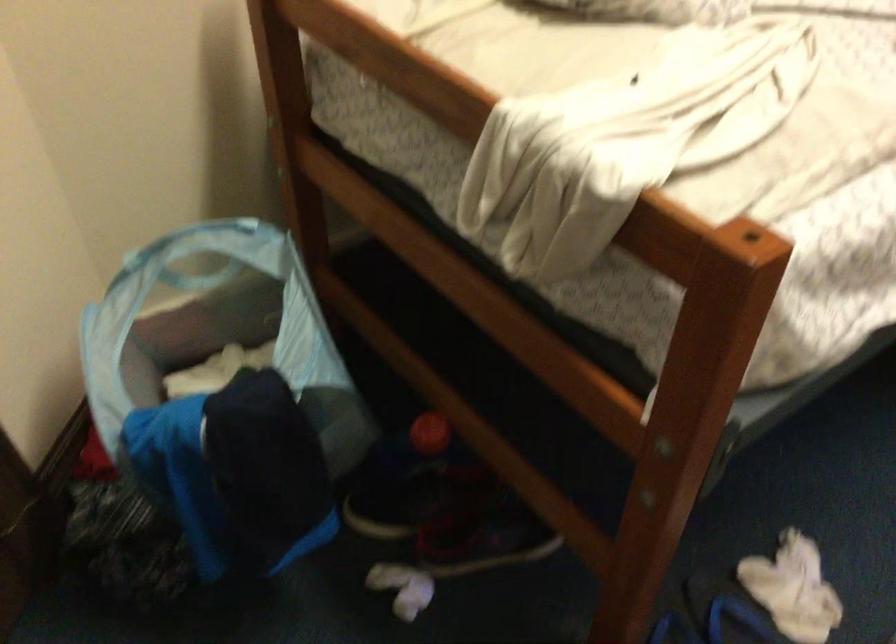
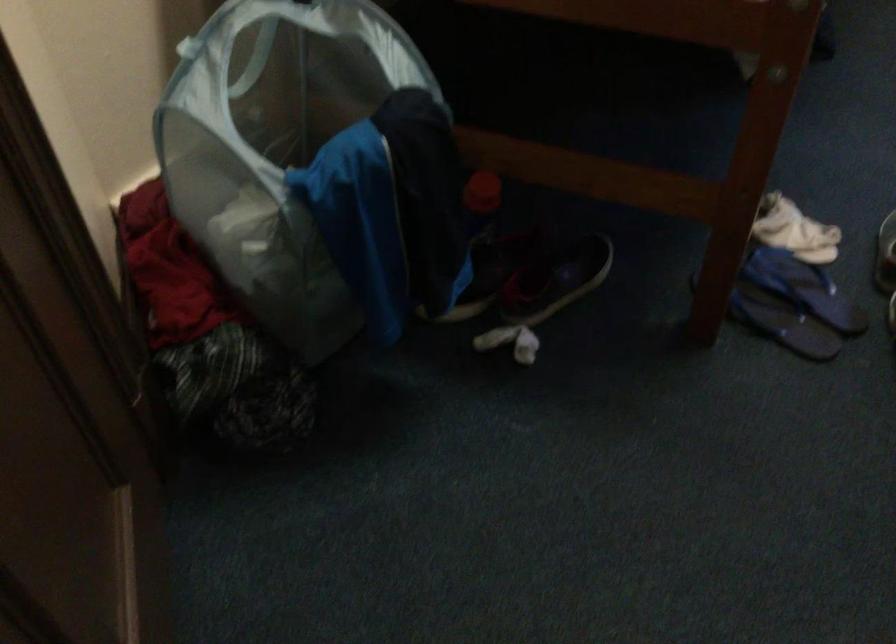
Find the pixel in the second image that matches [134,259] in the first image.

(186, 46)